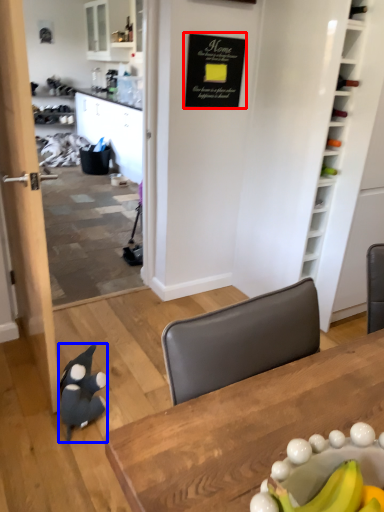
Question: Which point is closer to the camera, bulletin board (highlighted by a red box) or penguin (highlighted by a blue box)?

Choices:
 (A) bulletin board
 (B) penguin

Answer: (B)